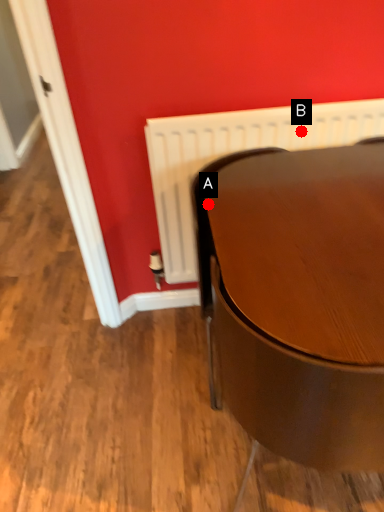
Question: Two points are circled on the image, labeled by A and B beside each circle. Which point is further to the camera?

Choices:
 (A) A is further
 (B) B is further

Answer: (B)